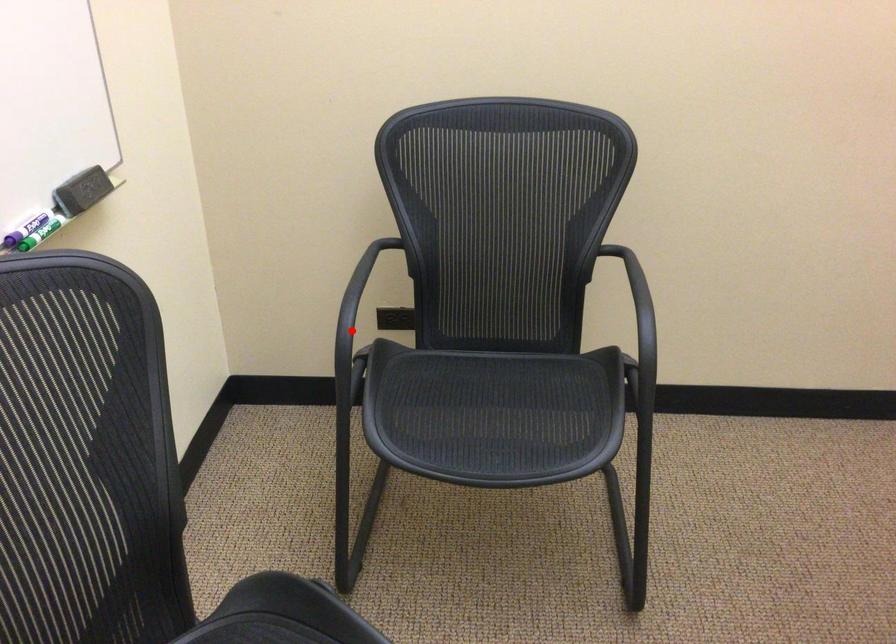
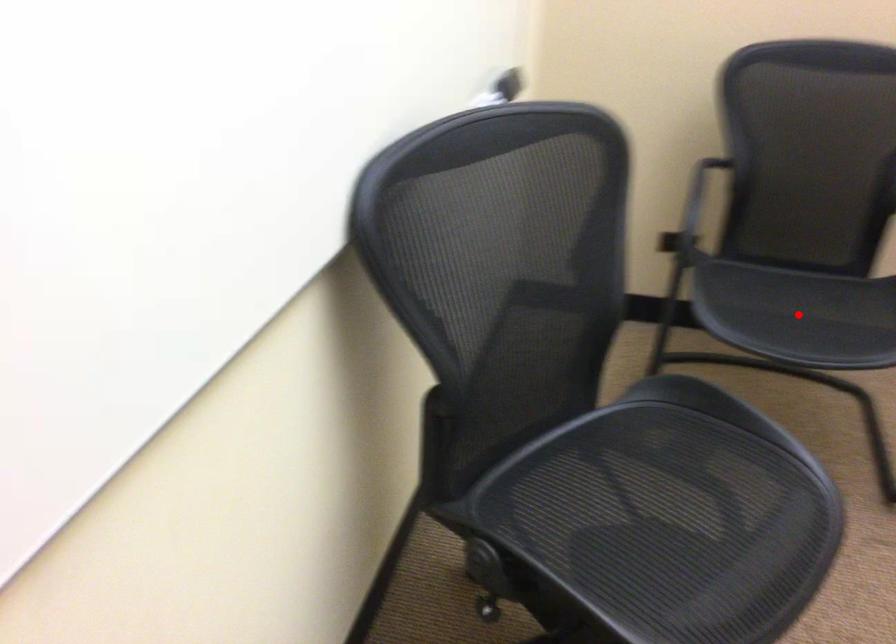
I am providing you with two images of the same scene from different viewpoints. A red point is marked on the first image and another point is marked on the second image. Do the highlighted points in image1 and image2 indicate the same real-world spot?

No